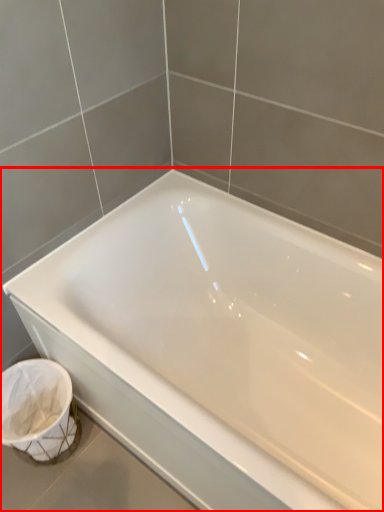
Question: From the image's perspective, where is bathtub (annotated by the red box) located in relation to laundry basket in the image?

Choices:
 (A) below
 (B) above

Answer: (B)